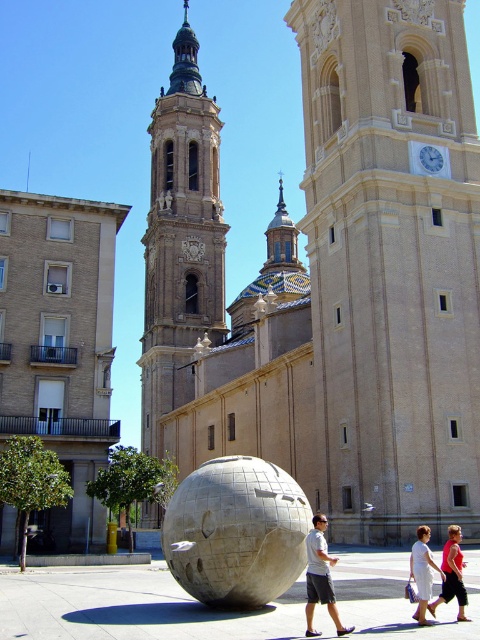
Question: Which object is closer to the camera taking this photo?

Choices:
 (A) stone sphere at center
 (B) matte pink shirt at center
 (C) beige stone church at center
 (D) smooth beige tower at center

Answer: (B)

Question: Among these points, which one is nearest to the camera?

Choices:
 (A) (224, 604)
 (B) (417, 580)

Answer: (B)

Question: Does brown brick church at left have a greater width compared to matte gray sphere at center?

Choices:
 (A) yes
 (B) no

Answer: (A)

Question: Which point is closer to the camera?

Choices:
 (A) (188, 195)
 (B) (442, 579)
 (C) (340, 627)

Answer: (C)

Question: Is stone sphere at center bigger than matte gray sphere at center?

Choices:
 (A) yes
 (B) no

Answer: (A)

Question: Considering the relative positions of beige stone church at center and smooth beige tower at center in the image provided, where is beige stone church at center located with respect to smooth beige tower at center?

Choices:
 (A) above
 (B) below

Answer: (B)